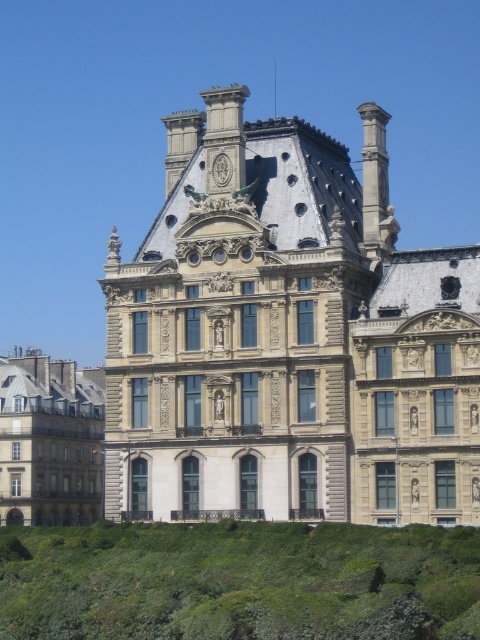
Question: Which is nearer to the matte stone building at left?

Choices:
 (A) green grass at lower left
 (B) beige stone building at center

Answer: (B)

Question: Which of these objects is positioned farthest from the beige stone building at center?

Choices:
 (A) matte stone building at left
 (B) green grass at lower left

Answer: (A)

Question: Is beige stone building at center smaller than green grass at lower left?

Choices:
 (A) no
 (B) yes

Answer: (A)

Question: Observing the image, what is the correct spatial positioning of beige stone building at center in reference to green grass at lower left?

Choices:
 (A) right
 (B) left

Answer: (B)

Question: Considering the real-world distances, which object is closest to the matte stone building at left?

Choices:
 (A) beige stone building at center
 (B) green grass at lower left

Answer: (A)

Question: Does beige stone building at center have a greater width compared to matte stone building at left?

Choices:
 (A) yes
 (B) no

Answer: (A)